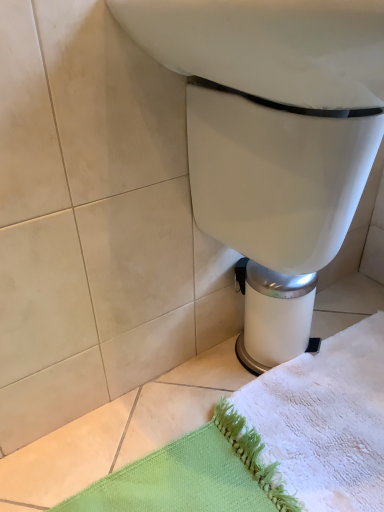
Question: Can you confirm if white textured bath towel at lower right is smaller than white glossy toilet at center?

Choices:
 (A) yes
 (B) no

Answer: (A)

Question: Is white textured bath towel at lower right in front of white glossy toilet at center?

Choices:
 (A) yes
 (B) no

Answer: (B)

Question: Can you confirm if white textured bath towel at lower right is shorter than white glossy toilet at center?

Choices:
 (A) yes
 (B) no

Answer: (A)

Question: Is white textured bath towel at lower right bigger than white glossy toilet at center?

Choices:
 (A) no
 (B) yes

Answer: (A)

Question: From the image's perspective, is white textured bath towel at lower right located above white glossy toilet at center?

Choices:
 (A) no
 (B) yes

Answer: (A)

Question: From a real-world perspective, is white textured bath towel at lower right under white glossy toilet at center?

Choices:
 (A) yes
 (B) no

Answer: (A)

Question: Can you confirm if white glossy toilet at center is wider than white textured bath towel at lower right?

Choices:
 (A) no
 (B) yes

Answer: (A)

Question: Is white textured bath towel at lower right at the back of white glossy toilet at center?

Choices:
 (A) yes
 (B) no

Answer: (B)

Question: Is white glossy toilet at center completely or partially outside of white textured bath towel at lower right?

Choices:
 (A) no
 (B) yes

Answer: (B)

Question: Is white glossy toilet at center aimed at white textured bath towel at lower right?

Choices:
 (A) yes
 (B) no

Answer: (B)

Question: Is white glossy toilet at center bigger than white textured bath towel at lower right?

Choices:
 (A) no
 (B) yes

Answer: (B)

Question: From the image's perspective, would you say white glossy toilet at center is shown under white textured bath towel at lower right?

Choices:
 (A) no
 (B) yes

Answer: (A)

Question: Would you say white textured bath towel at lower right is inside or outside white glossy toilet at center?

Choices:
 (A) inside
 (B) outside

Answer: (B)